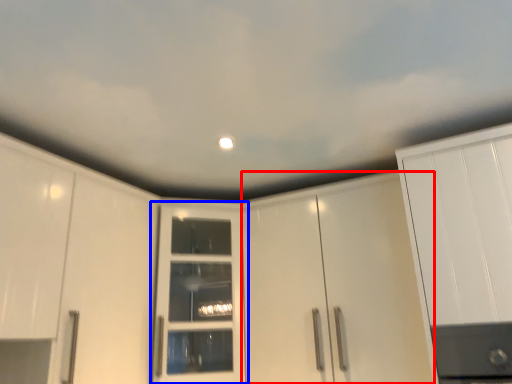
Question: Which object is further to the camera taking this photo, cabinetry (highlighted by a red box) or door (highlighted by a blue box)?

Choices:
 (A) cabinetry
 (B) door

Answer: (B)